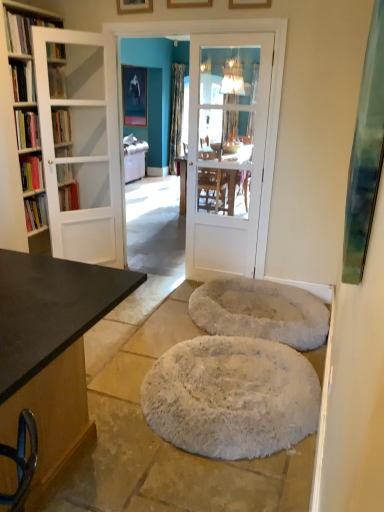
This screenshot has height=512, width=384. I want to click on vacant area on top of white glossy door at center, the 2th door positioned from the left (from a real-world perspective), so click(233, 34).